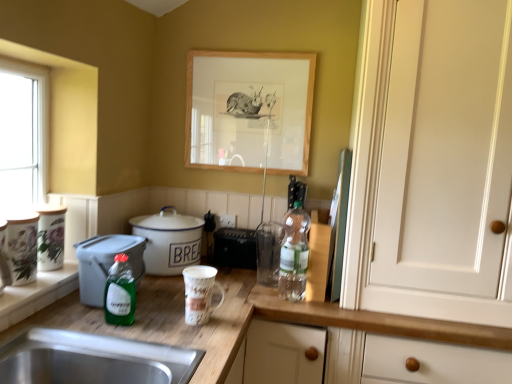
Question: From a real-world perspective, is matte ceramic mug at center, the fourth appliance viewed from the back, under green glass bottle at center, the first bottle in the front-to-back sequence?

Choices:
 (A) yes
 (B) no

Answer: (A)

Question: Is matte ceramic mug at center, which is the third appliance in right-to-left order, aimed at green glass bottle at center, which ranks as the 1th bottle in left-to-right order?

Choices:
 (A) no
 (B) yes

Answer: (A)

Question: Can you confirm if matte ceramic mug at center, the fourth appliance viewed from the back, is thinner than green glass bottle at center, the second bottle from the right?

Choices:
 (A) no
 (B) yes

Answer: (A)

Question: Considering the relative sizes of matte ceramic mug at center, positioned as the first appliance in front-to-back order, and green glass bottle at center, the first bottle in the front-to-back sequence, in the image provided, is matte ceramic mug at center, positioned as the first appliance in front-to-back order, taller than green glass bottle at center, the first bottle in the front-to-back sequence,?

Choices:
 (A) yes
 (B) no

Answer: (B)

Question: Does matte ceramic mug at center, positioned as the first appliance in front-to-back order, appear on the left side of green glass bottle at center, the first bottle in the front-to-back sequence?

Choices:
 (A) no
 (B) yes

Answer: (A)

Question: Is matte ceramic mug at center, the fourth appliance viewed from the back, smaller than green glass bottle at center, which is the 2th bottle in back-to-front order?

Choices:
 (A) yes
 (B) no

Answer: (B)

Question: Is wooden picture frame at upper center closer to the viewer compared to translucent plastic bottle at center, the second bottle when ordered from left to right?

Choices:
 (A) no
 (B) yes

Answer: (A)

Question: From a real-world perspective, is wooden picture frame at upper center over translucent plastic bottle at center, the 2th bottle when ordered from front to back?

Choices:
 (A) no
 (B) yes

Answer: (B)

Question: From a real-world perspective, is wooden picture frame at upper center beneath translucent plastic bottle at center, the first bottle from the right?

Choices:
 (A) no
 (B) yes

Answer: (A)

Question: Can you confirm if wooden picture frame at upper center is taller than translucent plastic bottle at center, placed as the first bottle when sorted from back to front?

Choices:
 (A) no
 (B) yes

Answer: (B)

Question: Is wooden picture frame at upper center facing away from translucent plastic bottle at center, the second bottle when ordered from left to right?

Choices:
 (A) yes
 (B) no

Answer: (B)

Question: Considering the relative sizes of wooden picture frame at upper center and translucent plastic bottle at center, the second bottle when ordered from left to right, in the image provided, is wooden picture frame at upper center smaller than translucent plastic bottle at center, the second bottle when ordered from left to right,?

Choices:
 (A) no
 (B) yes

Answer: (A)

Question: From a real-world perspective, is green glass bottle at center, the first bottle in the front-to-back sequence, under green plastic container at left, acting as the 1th cooker starting from the front?

Choices:
 (A) yes
 (B) no

Answer: (B)